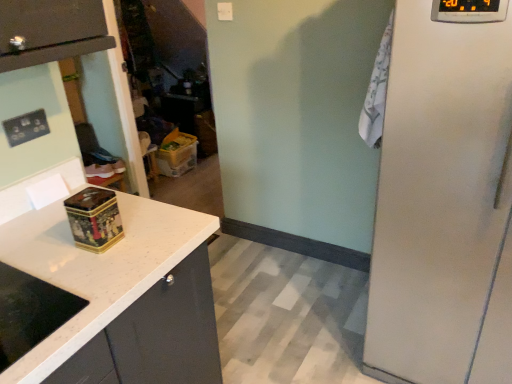
Question: Can you confirm if gold metallic tin at center, which ranks as the first appliance in left-to-right order, is smaller than satin white refrigerator at right, which appears as the second appliance when viewed from the back?

Choices:
 (A) yes
 (B) no

Answer: (A)

Question: Is gold metallic tin at center, which ranks as the first appliance in left-to-right order, not within satin white refrigerator at right, marked as the second appliance in a bottom-to-top arrangement?

Choices:
 (A) no
 (B) yes

Answer: (B)

Question: Is gold metallic tin at center, the 1th appliance from the back, positioned behind satin white refrigerator at right, the first appliance from the front?

Choices:
 (A) no
 (B) yes

Answer: (B)

Question: Is gold metallic tin at center, the second appliance when ordered from front to back, far from satin white refrigerator at right, which appears as the 2th appliance when viewed from the left?

Choices:
 (A) no
 (B) yes

Answer: (B)

Question: From the image's perspective, would you say gold metallic tin at center, acting as the 1th appliance starting from the bottom, is positioned over satin white refrigerator at right, positioned as the first appliance in right-to-left order?

Choices:
 (A) no
 (B) yes

Answer: (A)

Question: From the image's perspective, is matte black outlet at upper left above or below satin white refrigerator at right, which appears as the 2th appliance when viewed from the left?

Choices:
 (A) above
 (B) below

Answer: (A)

Question: Considering their positions, is matte black outlet at upper left located in front of or behind satin white refrigerator at right, which appears as the second appliance when viewed from the back?

Choices:
 (A) behind
 (B) front

Answer: (A)

Question: Is point (36, 127) positioned closer to the camera than point (437, 367)?

Choices:
 (A) closer
 (B) farther

Answer: (A)

Question: Considering the positions of matte black outlet at upper left and satin white refrigerator at right, marked as the second appliance in a bottom-to-top arrangement, in the image, is matte black outlet at upper left bigger or smaller than satin white refrigerator at right, marked as the second appliance in a bottom-to-top arrangement,?

Choices:
 (A) small
 (B) big

Answer: (A)

Question: Is white granite countertop at left taller or shorter than transparent plastic door at center?

Choices:
 (A) short
 (B) tall

Answer: (A)

Question: In the image, is white granite countertop at left positioned in front of or behind transparent plastic door at center?

Choices:
 (A) front
 (B) behind

Answer: (A)

Question: From a real-world perspective, is white granite countertop at left above or below transparent plastic door at center?

Choices:
 (A) above
 (B) below

Answer: (B)

Question: Does point (183, 332) appear closer or farther from the camera than point (138, 62)?

Choices:
 (A) farther
 (B) closer

Answer: (B)

Question: Is point (135, 49) closer or farther from the camera than point (76, 226)?

Choices:
 (A) closer
 (B) farther

Answer: (B)

Question: Is transparent plastic door at center to the left or to the right of gold metallic tin at center, the second appliance when ordered from front to back, in the image?

Choices:
 (A) left
 (B) right

Answer: (A)